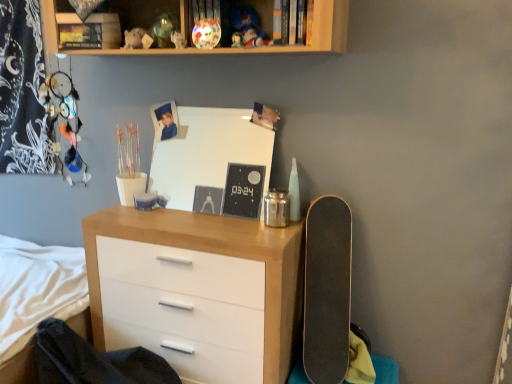
Question: Is wooden chest of drawers at center not close to hardcover book at upper center?

Choices:
 (A) yes
 (B) no

Answer: (A)

Question: Is wooden chest of drawers at center to the right of hardcover book at upper center from the viewer's perspective?

Choices:
 (A) no
 (B) yes

Answer: (A)

Question: Is hardcover book at upper center at the back of wooden chest of drawers at center?

Choices:
 (A) yes
 (B) no

Answer: (B)

Question: Can you confirm if wooden chest of drawers at center is thinner than hardcover book at upper center?

Choices:
 (A) no
 (B) yes

Answer: (A)

Question: Considering the relative sizes of wooden chest of drawers at center and hardcover book at upper center in the image provided, is wooden chest of drawers at center shorter than hardcover book at upper center?

Choices:
 (A) yes
 (B) no

Answer: (B)

Question: Considering the positions of black matte skateboard at right and wooden chest of drawers at center in the image, is black matte skateboard at right wider or thinner than wooden chest of drawers at center?

Choices:
 (A) thin
 (B) wide

Answer: (A)

Question: Does point (320, 283) appear closer or farther from the camera than point (196, 286)?

Choices:
 (A) farther
 (B) closer

Answer: (A)

Question: From a real-world perspective, is black matte skateboard at right physically located above or below wooden chest of drawers at center?

Choices:
 (A) above
 (B) below

Answer: (A)

Question: From the image's perspective, is black matte skateboard at right located above or below wooden chest of drawers at center?

Choices:
 (A) above
 (B) below

Answer: (A)

Question: Relative to matte white figurine at upper center, is black matte skateboard at right in front or behind?

Choices:
 (A) front
 (B) behind

Answer: (A)

Question: From the image's perspective, is black matte skateboard at right above or below matte white figurine at upper center?

Choices:
 (A) below
 (B) above

Answer: (A)

Question: Looking at their shapes, would you say black matte skateboard at right is wider or thinner than matte white figurine at upper center?

Choices:
 (A) wide
 (B) thin

Answer: (A)

Question: From their relative heights in the image, would you say black matte skateboard at right is taller or shorter than matte white figurine at upper center?

Choices:
 (A) short
 (B) tall

Answer: (B)

Question: From their relative heights in the image, would you say matte white figurine at upper center is taller or shorter than wooden shelf at upper center?

Choices:
 (A) tall
 (B) short

Answer: (B)

Question: Does point (178, 31) appear closer or farther from the camera than point (331, 1)?

Choices:
 (A) farther
 (B) closer

Answer: (A)